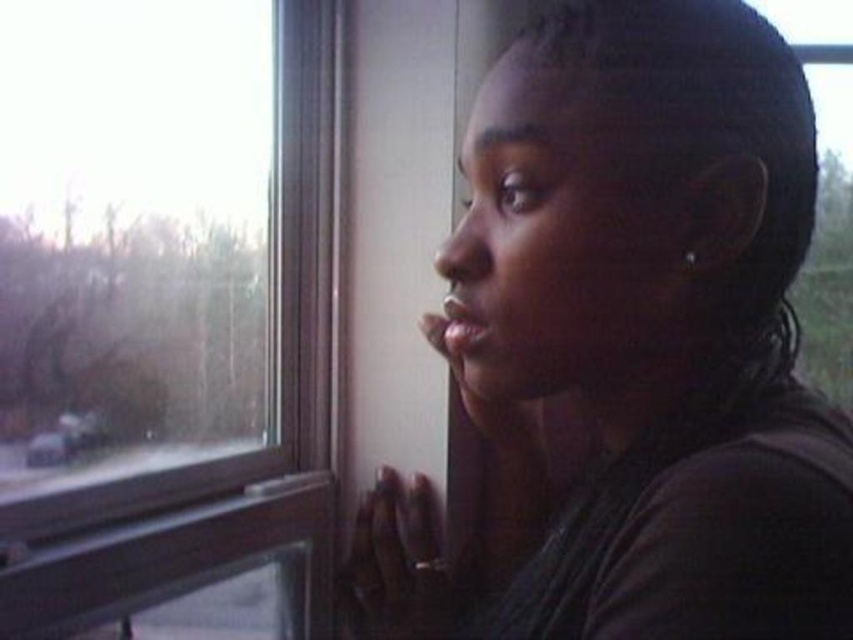
Question: Among these objects, which one is farthest from the camera?

Choices:
 (A) transparent glass window at upper left
 (B) dark brown hair at upper right

Answer: (A)

Question: Can you confirm if dark brown hair at upper right is positioned to the left of transparent glass window at upper left?

Choices:
 (A) yes
 (B) no

Answer: (B)

Question: Can you confirm if dark brown hair at upper right is positioned to the right of transparent glass window at upper left?

Choices:
 (A) no
 (B) yes

Answer: (B)

Question: Which point is farther to the camera?

Choices:
 (A) (293, 308)
 (B) (538, 634)

Answer: (A)

Question: Considering the relative positions of dark brown hair at upper right and transparent glass window at upper left in the image provided, where is dark brown hair at upper right located with respect to transparent glass window at upper left?

Choices:
 (A) right
 (B) left

Answer: (A)